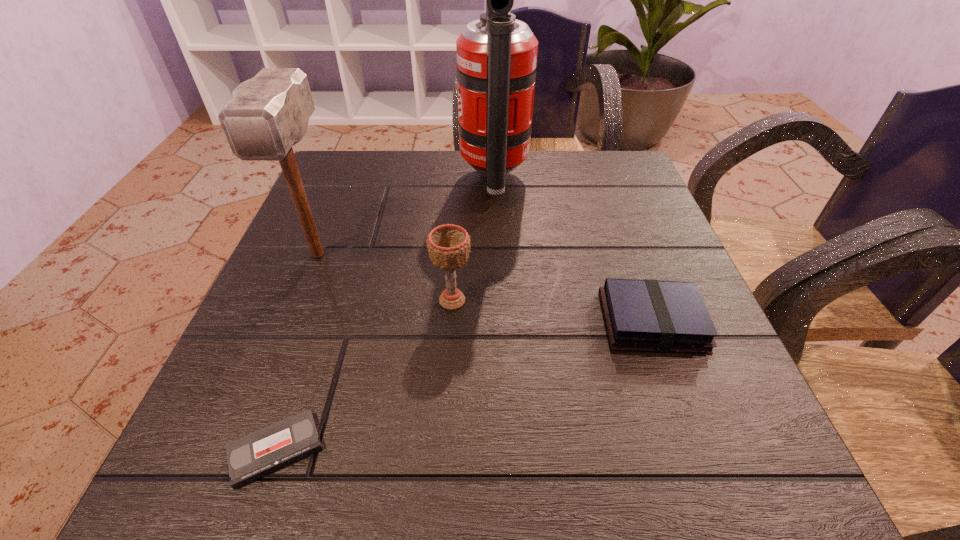
This screenshot has height=540, width=960. What are the coordinates of `vacant area situated 0.110m on the front label side of the farthest object` in the screenshot? It's located at coord(414,180).

The width and height of the screenshot is (960, 540). Identify the location of vacant point located 0.310m on the front label side of the farthest object. (331, 180).

This screenshot has width=960, height=540. Identify the location of vacant region located 0.050m on the striking face of the fourth shortest object. (298, 305).

What are the coordinates of `blank space located on the back of the chalice` in the screenshot? It's located at (459, 197).

You are a GUI agent. You are given a task and a screenshot of the screen. Output one action in this format:
    pyautogui.click(x=<x>, y=<y>)
    Task: Click on the free region located 0.230m on the left of the rightmost object
    Image resolution: width=960 pixels, height=540 pixels.
    Given the screenshot: What is the action you would take?
    pyautogui.click(x=466, y=322)

Locate an element on the screen. The image size is (960, 540). vacant space located 0.370m on the back of the nearest object is located at coordinates (346, 245).

Find the location of `object that is at the far edge`. object that is at the far edge is located at coordinates (497, 54).

Find the location of a particular element. object situated at the near edge is located at coordinates (255, 455).

The width and height of the screenshot is (960, 540). I want to click on mallet that is positioned at the left edge, so click(268, 114).

Where is `videotape at the left edge`? The image size is (960, 540). videotape at the left edge is located at coordinates (255, 455).